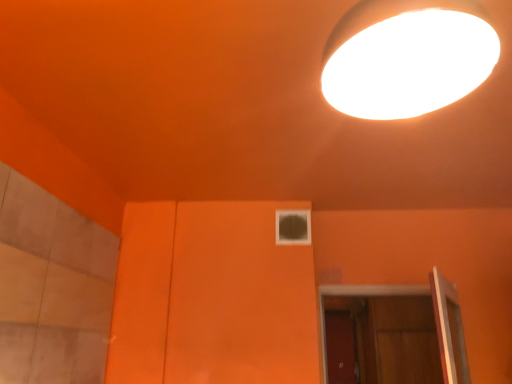
Question: Should I look upward or downward to see wooden at lower right?

Choices:
 (A) up
 (B) down

Answer: (B)

Question: From the image's perspective, does wooden at lower right appear lower than transparent glass window at center?

Choices:
 (A) yes
 (B) no

Answer: (A)

Question: Does wooden at lower right have a greater height compared to transparent glass window at center?

Choices:
 (A) no
 (B) yes

Answer: (B)

Question: Is wooden at lower right touching transparent glass window at center?

Choices:
 (A) no
 (B) yes

Answer: (A)

Question: Is wooden at lower right positioned beyond the bounds of transparent glass window at center?

Choices:
 (A) no
 (B) yes

Answer: (B)

Question: Considering the relative sizes of wooden at lower right and transparent glass window at center in the image provided, is wooden at lower right bigger than transparent glass window at center?

Choices:
 (A) yes
 (B) no

Answer: (A)

Question: Can transparent glass window at center be found inside wooden at lower right?

Choices:
 (A) no
 (B) yes

Answer: (A)

Question: Does transparent glass window at center turn towards wooden at lower right?

Choices:
 (A) yes
 (B) no

Answer: (B)

Question: From the image's perspective, is transparent glass window at center above wooden at lower right?

Choices:
 (A) no
 (B) yes

Answer: (B)

Question: Does transparent glass window at center have a greater width compared to wooden at lower right?

Choices:
 (A) no
 (B) yes

Answer: (A)

Question: From the image's perspective, is transparent glass window at center below wooden at lower right?

Choices:
 (A) yes
 (B) no

Answer: (B)

Question: Is wooden at lower right inside transparent glass window at center?

Choices:
 (A) yes
 (B) no

Answer: (B)

Question: Is the position of transparent glass window at center more distant than that of wooden at lower right?

Choices:
 (A) no
 (B) yes

Answer: (A)

Question: From a real-world perspective, is transparent glass window at center under white glossy lamp at upper right?

Choices:
 (A) yes
 (B) no

Answer: (B)